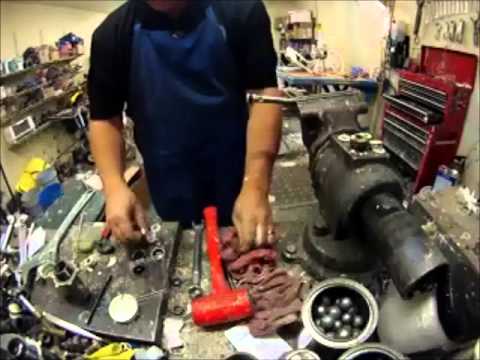
Identify the location of red cloth. (262, 254).